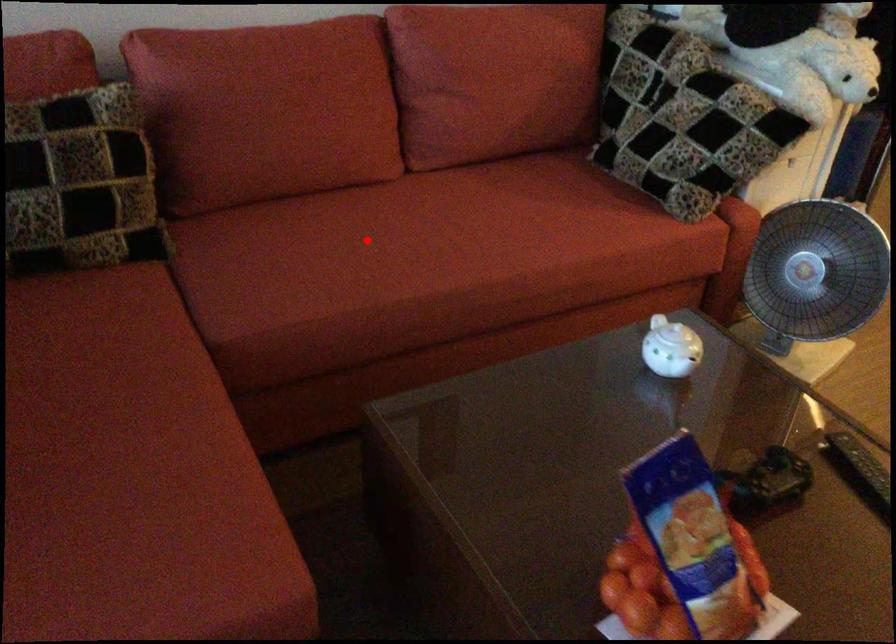
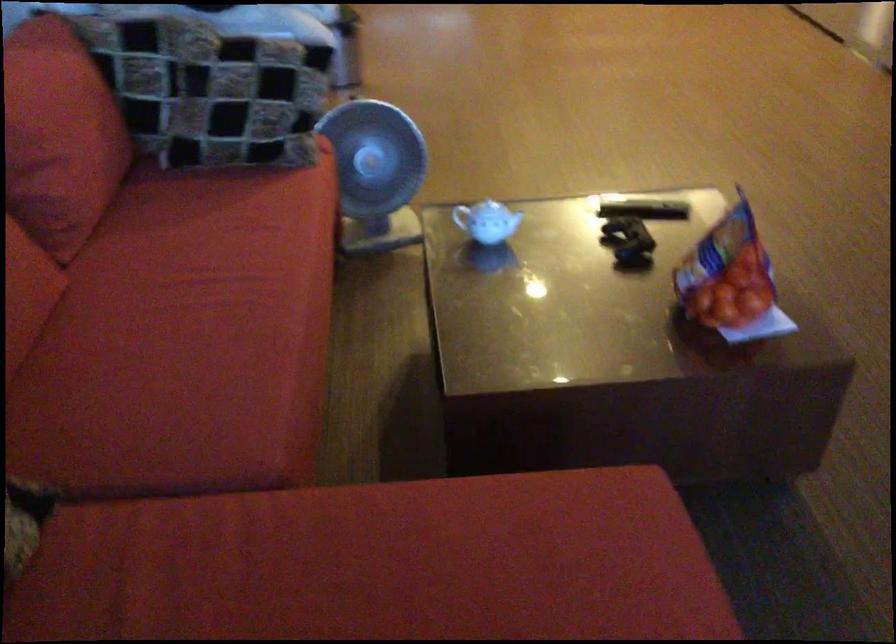
Question: I am providing you with two images of the same scene from different viewpoints. Given a red point in image1, look at the same physical point in image2. Is it:

Choices:
 (A) Closer to the viewpoint
 (B) Farther from the viewpoint

Answer: (A)